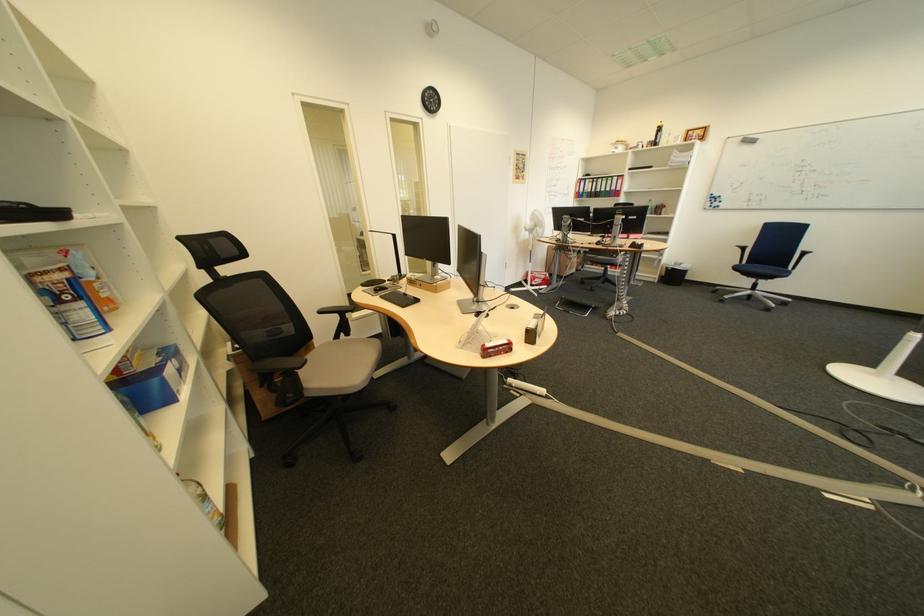
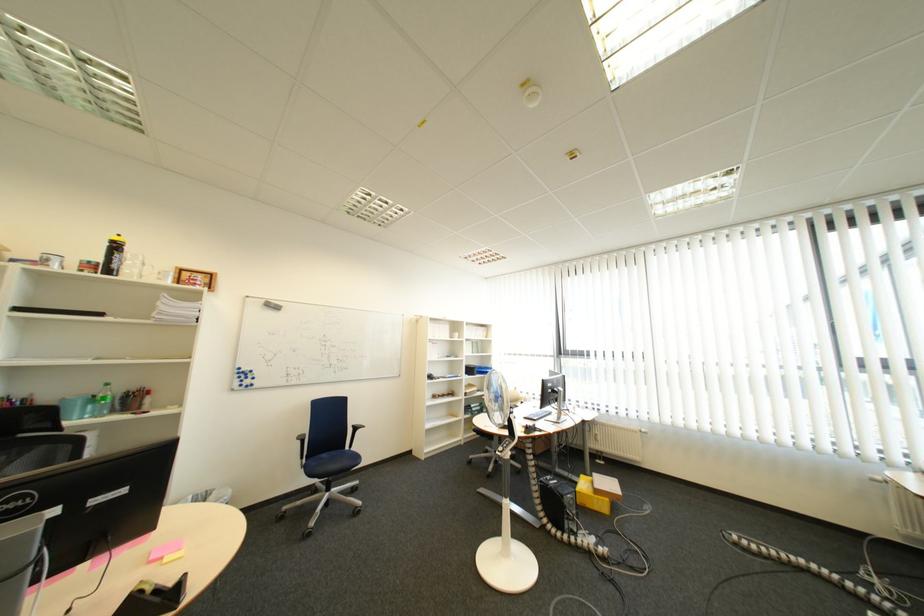
In the second image, find the point that corresponds to point 671,142 in the first image.

(128, 267)